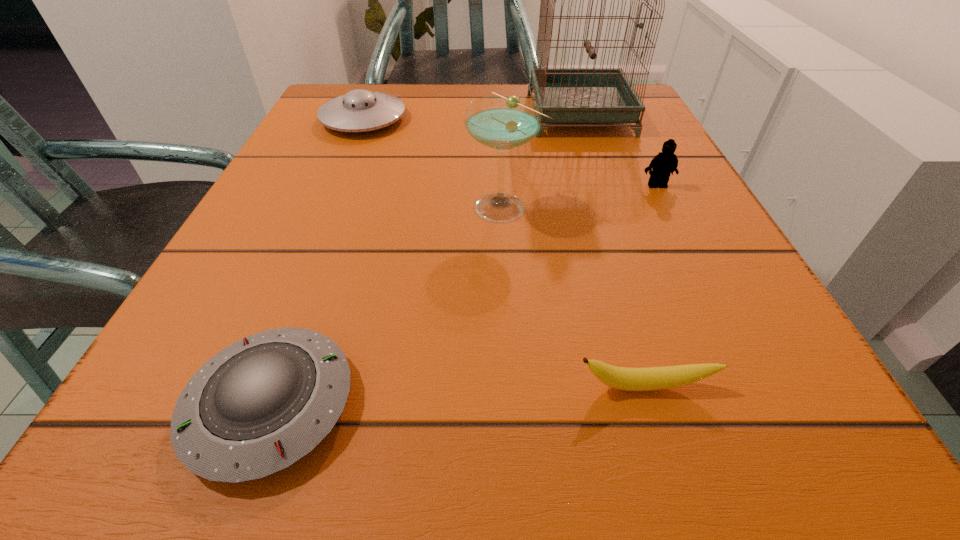
The width and height of the screenshot is (960, 540). I want to click on the tallest object, so click(567, 95).

At what (x,y) coordinates should I click in order to perform the action: click on the fourth object from right to left. Please return your answer as a coordinate pair (x, y). Image resolution: width=960 pixels, height=540 pixels. Looking at the image, I should click on (501, 122).

Image resolution: width=960 pixels, height=540 pixels. I want to click on the fifth shortest object, so click(501, 122).

I want to click on Lego, so click(665, 163).

Identify the location of the third shortest object. (359, 110).

Image resolution: width=960 pixels, height=540 pixels. What are the coordinates of `the farther saucer` in the screenshot? It's located at (359, 110).

The height and width of the screenshot is (540, 960). What are the coordinates of `banana` in the screenshot? It's located at (653, 378).

The image size is (960, 540). What are the coordinates of `the nearer saucer` in the screenshot? It's located at (261, 404).

Where is `vacant area situated 0.280m at the door of the tallest object`? The width and height of the screenshot is (960, 540). vacant area situated 0.280m at the door of the tallest object is located at coordinates (397, 114).

Locate an element on the screen. The width and height of the screenshot is (960, 540). free region located 0.160m at the door of the tallest object is located at coordinates 454,114.